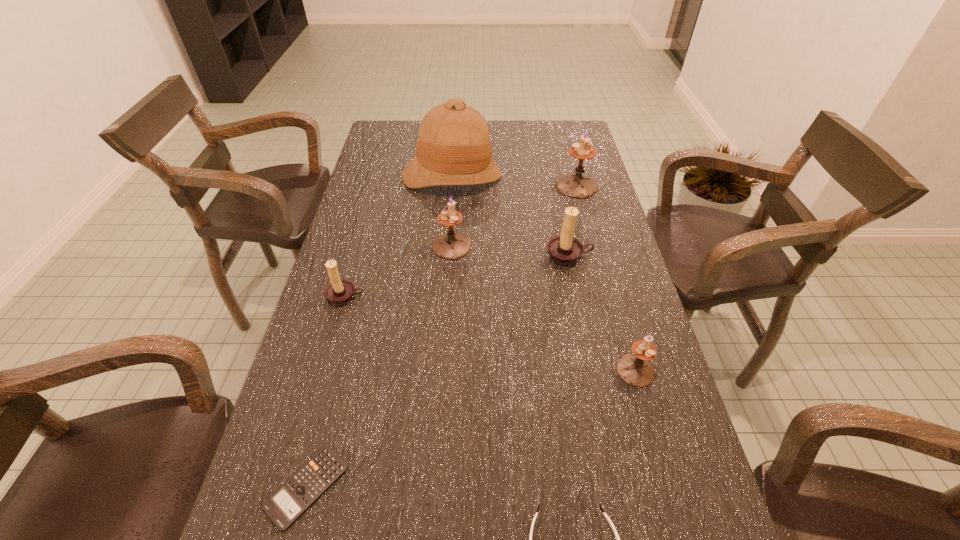
Locate an element on the screen. The image size is (960, 540). empty location between the nearer brown candle holder and the calculator is located at coordinates (326, 392).

Where is `free area in between the smallest purple candle holder and the second smallest purple candle holder`? free area in between the smallest purple candle holder and the second smallest purple candle holder is located at coordinates (543, 308).

Find the location of a particular element. This screenshot has height=540, width=960. vacant region between the fourth candle holder from right to left and the calculator is located at coordinates click(x=379, y=366).

The width and height of the screenshot is (960, 540). What are the coordinates of `vacant space that is in between the calculator and the leftmost purple candle holder` in the screenshot? It's located at (379, 366).

The width and height of the screenshot is (960, 540). I want to click on unoccupied area between the smaller brown candle holder and the hat, so click(x=398, y=237).

Identify the location of object that ranks as the fifth closest to the fourth nearest object. (606, 516).

Locate which object is the sixth closest to the calculator. Please provide its 2D coordinates. Your answer should be formatted as a tuple, i.e. [(x, y)], where the tuple contains the x and y coordinates of a point satisfying the conditions above.

[(453, 148)]

The height and width of the screenshot is (540, 960). What are the coordinates of `candle holder that is the fifth closest to the seventh tallest object` in the screenshot? It's located at (575, 185).

Point out which candle holder is positioned as the third nearest to the third nearest object. Please provide its 2D coordinates. Your answer should be formatted as a tuple, i.e. [(x, y)], where the tuple contains the x and y coordinates of a point satisfying the conditions above.

[(575, 185)]

Where is `purple candle holder that is the second nearest to the second biggest purple candle holder`? purple candle holder that is the second nearest to the second biggest purple candle holder is located at coordinates (635, 369).